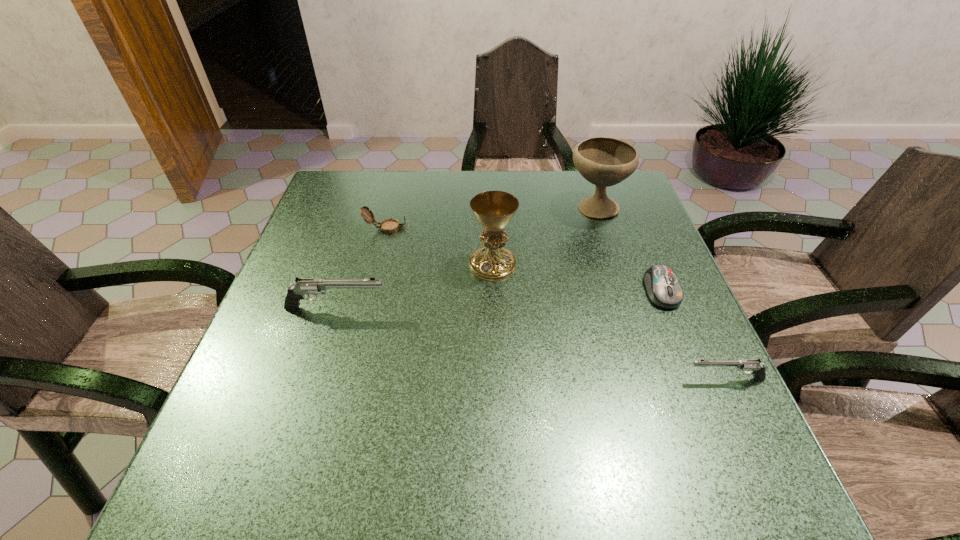
Where is `pistol that is at the right edge`? The image size is (960, 540). pistol that is at the right edge is located at coordinates (754, 367).

You are a GUI agent. You are given a task and a screenshot of the screen. Output one action in this format:
    pyautogui.click(x=<x>, y=<y>)
    Task: Click on the chalice positioned at the right edge
    The height and width of the screenshot is (540, 960).
    Given the screenshot: What is the action you would take?
    click(602, 161)

Find the location of a particular element. computer mouse located in the right edge section of the desktop is located at coordinates (663, 288).

Image resolution: width=960 pixels, height=540 pixels. What are the coordinates of `object located at the far right corner` in the screenshot? It's located at (602, 161).

Find the location of a particular element. Image resolution: width=960 pixels, height=540 pixels. free space at the far edge of the desktop is located at coordinates (439, 186).

Locate an element on the screen. vacant space at the near edge of the desktop is located at coordinates (523, 432).

Image resolution: width=960 pixels, height=540 pixels. I want to click on vacant point at the left edge, so click(359, 239).

Where is `vacant region at the right edge of the desktop`? The image size is (960, 540). vacant region at the right edge of the desktop is located at coordinates (631, 327).

Where is `vacant region between the compass and the computer mouse`? Image resolution: width=960 pixels, height=540 pixels. vacant region between the compass and the computer mouse is located at coordinates (524, 259).

Locate an element on the screen. free space between the computer mouse and the nearer chalice is located at coordinates (577, 278).